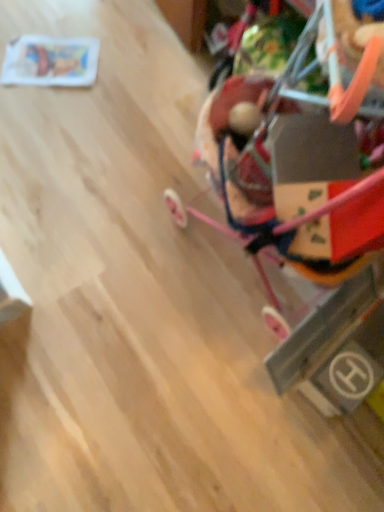
Where is `pink plastic toy stroller at right`? This screenshot has width=384, height=512. pink plastic toy stroller at right is located at coordinates (300, 160).

Describe the element at coordinates (300, 160) in the screenshot. I see `pink plastic toy stroller at right` at that location.

Locate an element on the screen. The width and height of the screenshot is (384, 512). pink plastic toy stroller at right is located at coordinates (300, 160).